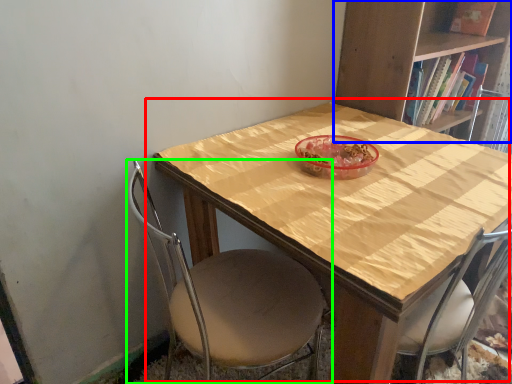
Question: Which is farther away from table (highlighted by a red box)? bookcase (highlighted by a blue box) or chair (highlighted by a green box)?

Choices:
 (A) bookcase
 (B) chair

Answer: (A)